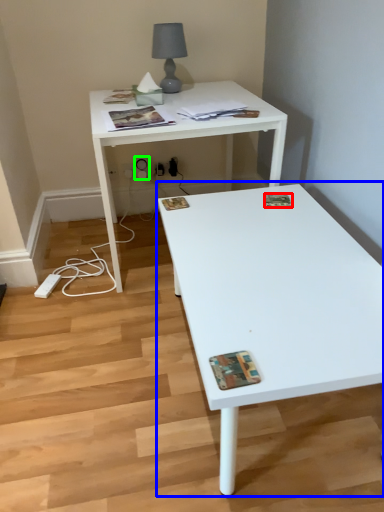
Question: Which object is the farthest from magazine (highlighted by a red box)? Choose among these: coffee table (highlighted by a blue box) or electric outlet (highlighted by a green box).

Choices:
 (A) coffee table
 (B) electric outlet

Answer: (B)